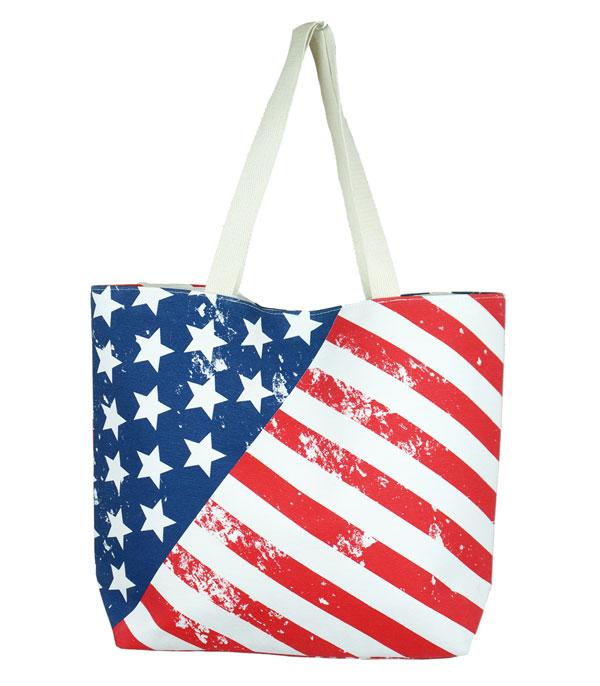
Locate an element on the screen. The width and height of the screenshot is (600, 686). hook is located at coordinates (323, 36).